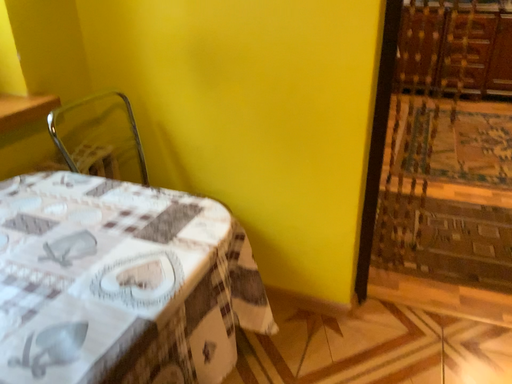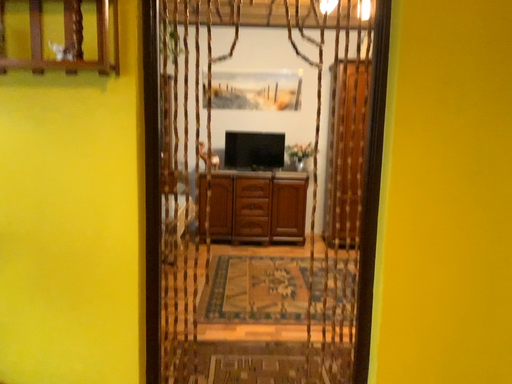
Question: How did the camera likely rotate when shooting the video?

Choices:
 (A) rotated upward
 (B) rotated downward

Answer: (A)